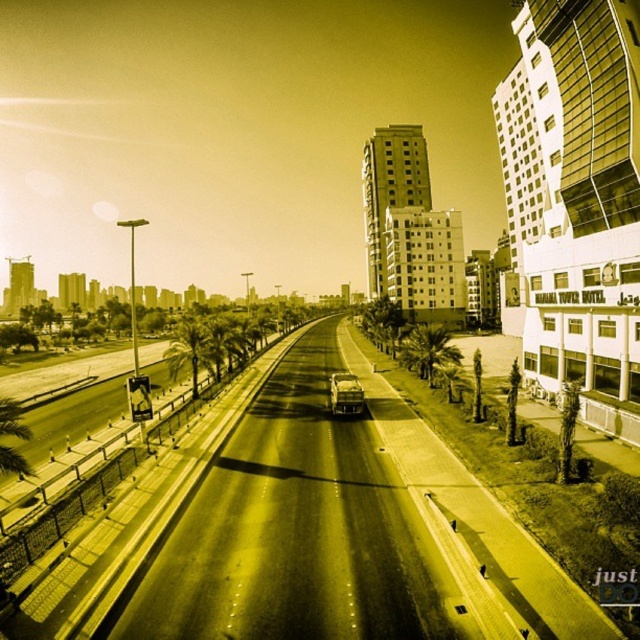
Which is more to the left, green leafy palm tree at center-right or green leafy palm tree at center-left?

green leafy palm tree at center-left is more to the left.

Is green leafy palm tree at center-right to the left of green leafy palm tree at center-left from the viewer's perspective?

Incorrect, green leafy palm tree at center-right is not on the left side of green leafy palm tree at center-left.

Where is `green leafy palm tree at center-right`? This screenshot has height=640, width=640. green leafy palm tree at center-right is located at coordinates (426, 349).

Between green leafy palm tree at right and shiny silver car at center, which one appears on the left side from the viewer's perspective?

shiny silver car at center is more to the left.

Describe the element at coordinates (566, 428) in the screenshot. I see `green leafy palm tree at right` at that location.

Between point (564, 412) and point (342, 401), which one is positioned in front?

Point (564, 412) is in front.

The width and height of the screenshot is (640, 640). What are the coordinates of `green leafy palm tree at right` in the screenshot? It's located at (566, 428).

Who is more distant from viewer, (x=173, y=336) or (x=563, y=445)?

The point (x=173, y=336) is behind.

What do you see at coordinates (188, 348) in the screenshot?
I see `green leafy palm tree at center-left` at bounding box center [188, 348].

Locate an element on the screen. The image size is (640, 640). green leafy palm tree at center-left is located at coordinates (188, 348).